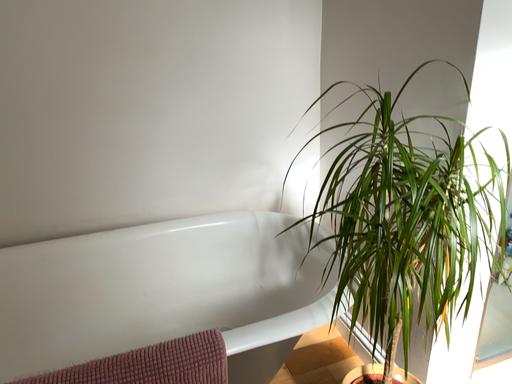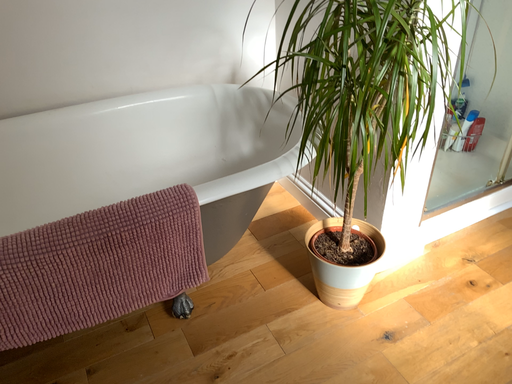
Question: How did the camera likely rotate when shooting the video?

Choices:
 (A) rotated upward
 (B) rotated downward

Answer: (B)